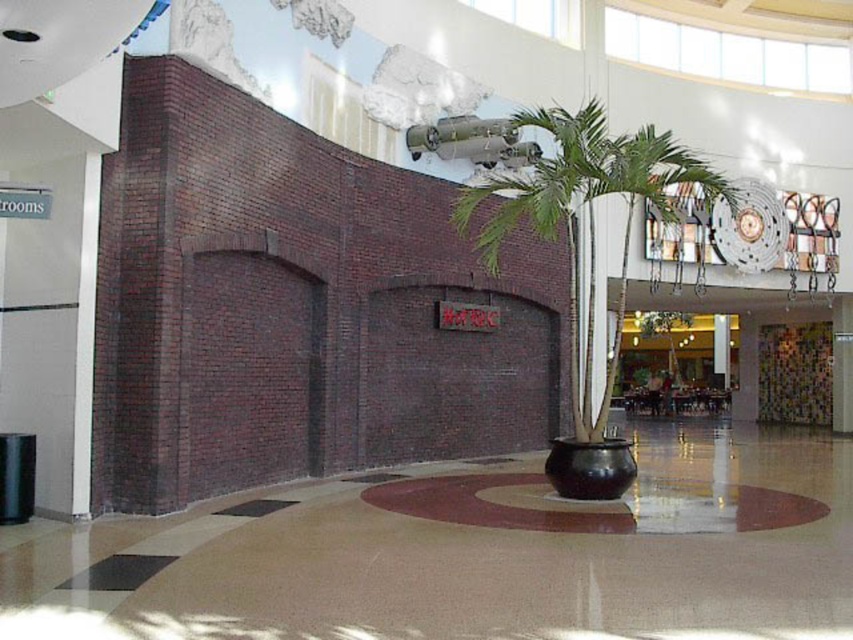
You are standing in the lobby and want to take a photo of both point (582, 298) and point (654, 522). Which point should you focus on first to ensure both are in clear view?

You should focus on point (582, 298) first because it is closer to the camera than point (654, 522), ensuring both points are in focus.

You are standing in the lobby and want to place a new decorative item on the floor. The green glossy palm tree at center is currently at position coordinates point 0.403, 0.686. If you want to place the new item 0.1 units to the right of the palm tree, what are the new coordinates?

The new coordinates would be (584,321) because adding 0.1 to the x coordinate of the green glossy palm tree at center moves it 0.1 units to the right while keeping the y coordinate the same.

You are an interior designer arranging a space. You have a green glossy palm tree at center and a shiny black vase at center. Which object should you move to the left to align with the curved brick wall on the left side?

You should move the shiny black vase at center to the left because the green glossy palm tree at center is already positioned to its right, so moving the vase left would align it better with the curved brick wall on the left side.